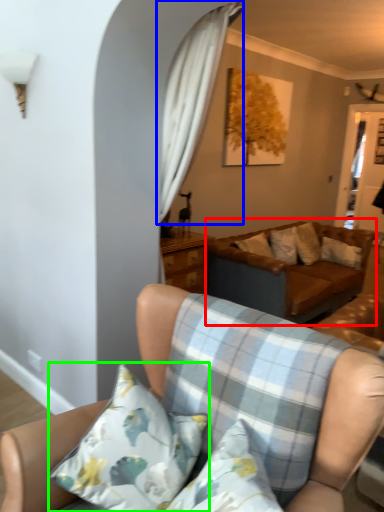
Question: Which object is positioned closest to studio couch (highlighted by a red box)? Select from curtain (highlighted by a blue box) and pillow (highlighted by a green box).

Choices:
 (A) curtain
 (B) pillow

Answer: (A)